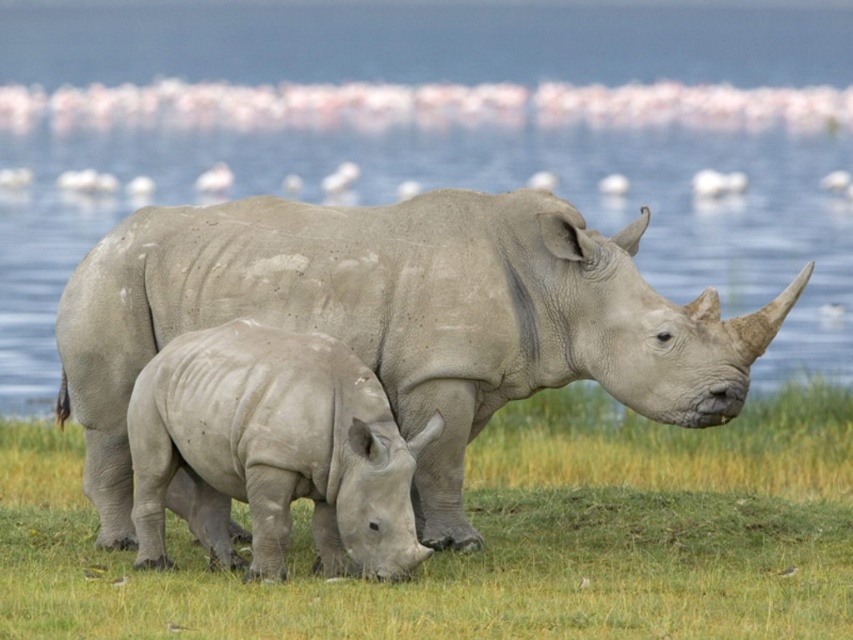
Based on the photo, you are a wildlife photographer aiming to capture a photo of the smooth gray rhino at center while staying at least 8 meters away for safety. Can you safely take the photo from your current position near the clear blue water at center?

The distance between the clear blue water at center and the smooth gray rhino at center is 8.92 meters, which is more than the required 8 meters. Therefore, you can safely take the photo from your current position near the clear blue water at center.

You are a photographer trying to capture the smooth gray rhino at center and the clear blue water at center in the same frame. Based on the scene, which object is narrower in width?

The clear blue water at center has a lesser width compared to the smooth gray rhino at center, so the clear blue water at center is narrower in width.

You are standing at the point labeled as point (769, 413) and want to take a photo of the two rhinos. The camera you are using has a maximum focusing distance of 12 meters. Will the camera be able to focus on the rhinos?

The distance between point (769, 413) and the camera is 12.75 meters, which exceeds the camera maximum focusing distance of 12 meters. Therefore, the camera will not be able to focus on the rhinos.